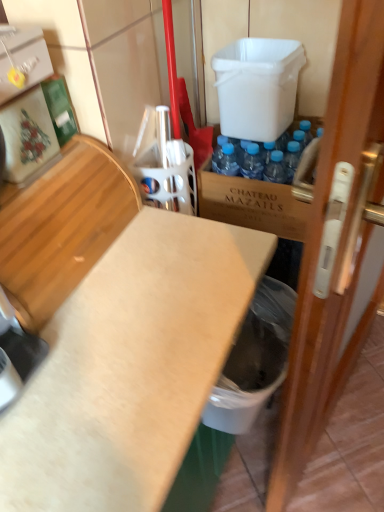
At what (x,y) coordinates should I click in order to perform the action: click on free space in front of light brown wood at left. Please return your answer as a coordinate pair (x, y). Looking at the image, I should click on (89, 371).